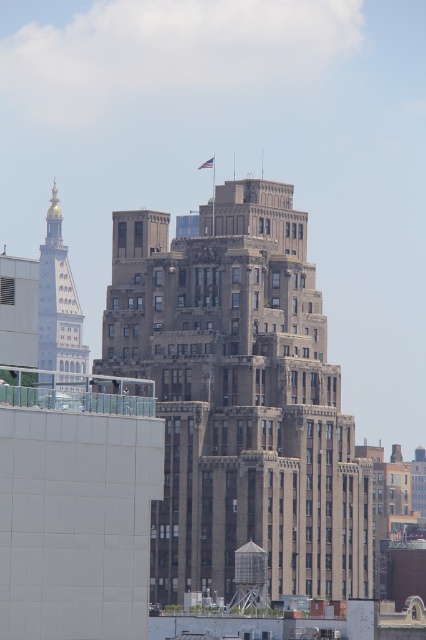
Question: Does brown stone building at center have a smaller size compared to gold-bronze tower at left?

Choices:
 (A) no
 (B) yes

Answer: (B)

Question: Which of the following is the closest to the observer?

Choices:
 (A) brown stone building at center
 (B) gold-bronze tower at left

Answer: (B)

Question: Is brown stone building at center closer to the viewer compared to gold-bronze tower at left?

Choices:
 (A) yes
 (B) no

Answer: (B)

Question: Which of the following is the closest to the observer?

Choices:
 (A) gold-bronze tower at left
 (B) brown stone building at center

Answer: (A)

Question: Does brown stone building at center appear on the right side of gold-bronze tower at left?

Choices:
 (A) yes
 (B) no

Answer: (A)